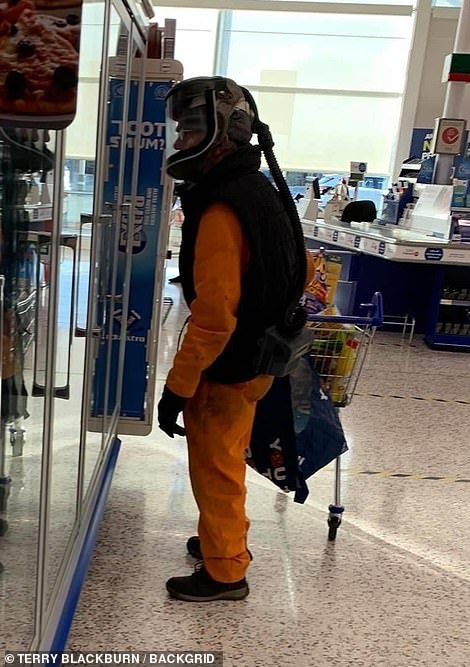
The image size is (470, 667). Find the location of `floor`. floor is located at coordinates tap(342, 568).